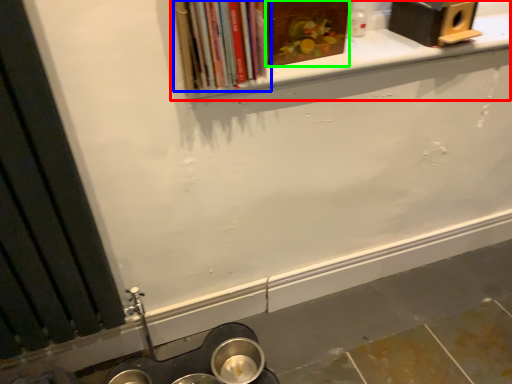
Question: Based on their relative distances, which object is farther from window sill (highlighted by a red box)? Choose from book (highlighted by a blue box) and book (highlighted by a green box).

Choices:
 (A) book
 (B) book

Answer: (A)